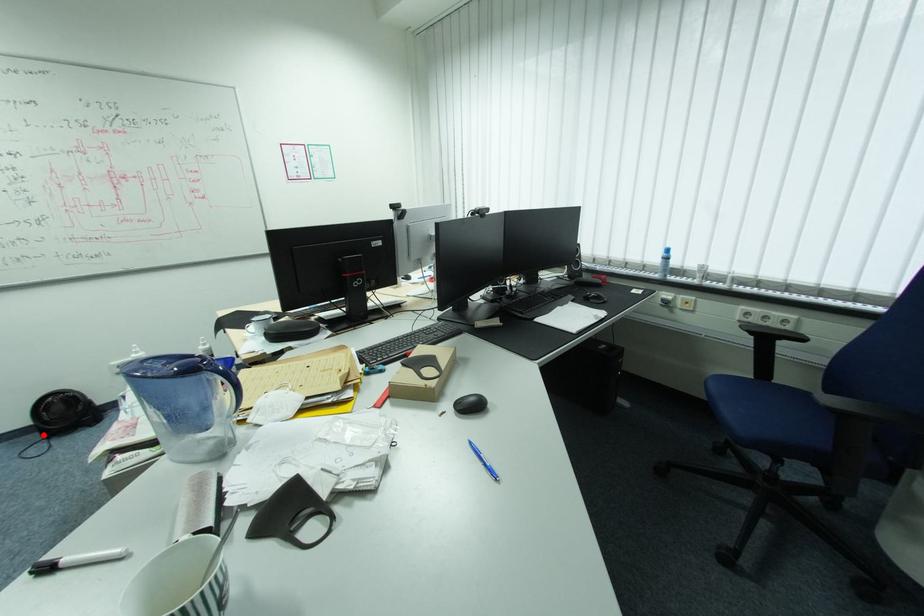
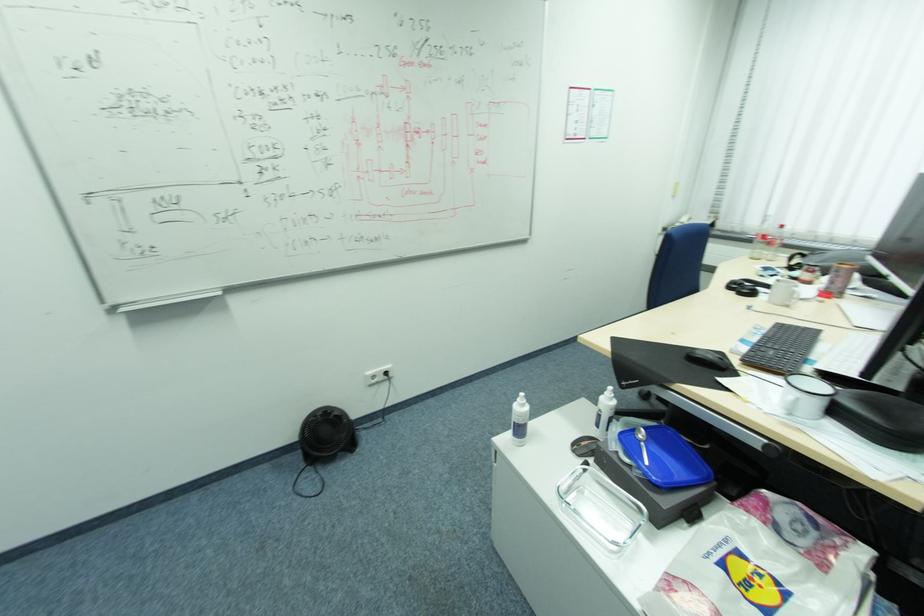
In the second image, find the point that corresponds to the highlighted location in the first image.

(304, 456)